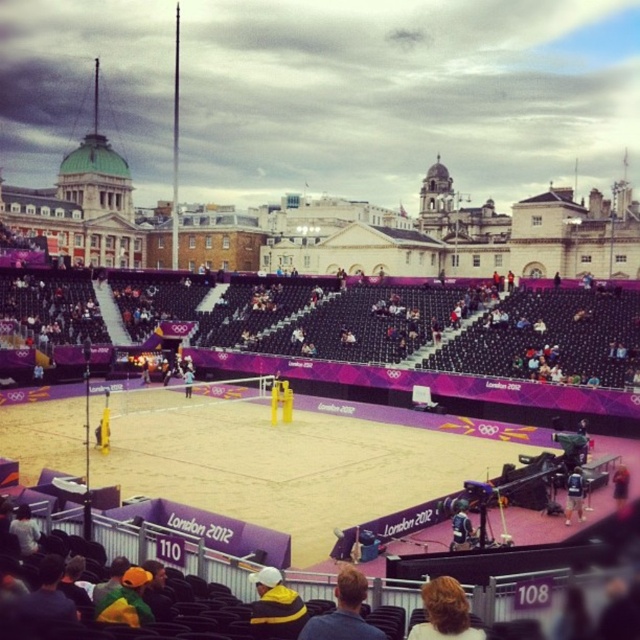
You are a photographer at the London 2012 Olympics beach volleyball venue. You want to take a photo of the point at coordinates point (349, 620). If your camera has a maximum focus range of 45 meters, will you be able to capture the point clearly?

The point (349, 620) and the camera are 45.12 meters apart. Since the distance exceeds the camera maximum focus range of 45 meters, the camera will not be able to capture the point clearly.

Consider the image. You are a photographer at the London 2012 Olympics beach volleyball venue. You need to capture a photo of both the yellow and black jacket at lower center and the blonde hair at lower center. Based on their heights, which object should you focus on first to ensure both are in frame?

The yellow and black jacket at lower center is not as tall as the blonde hair at lower center, so you should focus on the blonde hair at lower center first to ensure both are in frame.

You are a photographer at the London 2012 Olympics beach volleyball venue. You need to capture a photo of both the denim jacket at lower center and the yellow and black jacket at lower center in the same frame. Given their positions, which jacket will appear smaller in the final photo?

The denim jacket at lower center will appear smaller in the final photo because it occupies less space than the yellow and black jacket at lower center.